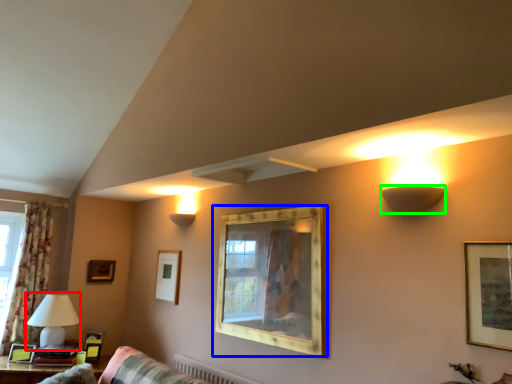
Question: Estimate the real-world distances between objects in this image. Which object is farther from table lamp (highlighted by a red box), picture frame (highlighted by a blue box) or lamp (highlighted by a green box)?

Choices:
 (A) picture frame
 (B) lamp

Answer: (B)